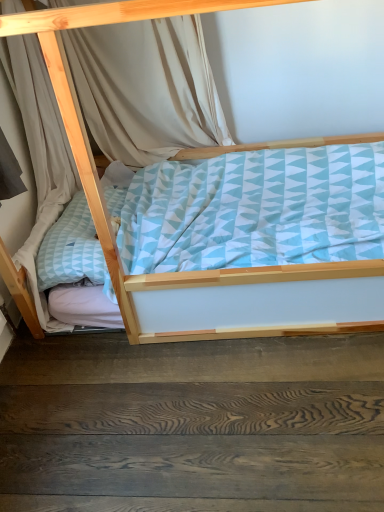
Question: Is dark wood floor at lower center smaller than light blue fabric bed at center?

Choices:
 (A) yes
 (B) no

Answer: (A)

Question: Would you consider dark wood floor at lower center to be distant from light blue fabric bed at center?

Choices:
 (A) no
 (B) yes

Answer: (A)

Question: Could you tell me if dark wood floor at lower center is facing light blue fabric bed at center?

Choices:
 (A) no
 (B) yes

Answer: (A)

Question: From the image's perspective, is dark wood floor at lower center beneath light blue fabric bed at center?

Choices:
 (A) yes
 (B) no

Answer: (A)

Question: Does dark wood floor at lower center have a greater width compared to light blue fabric bed at center?

Choices:
 (A) yes
 (B) no

Answer: (B)

Question: Is light blue fabric bed at center bigger or smaller than dark wood floor at lower center?

Choices:
 (A) big
 (B) small

Answer: (A)

Question: Considering the positions of light blue fabric bed at center and dark wood floor at lower center in the image, is light blue fabric bed at center wider or thinner than dark wood floor at lower center?

Choices:
 (A) thin
 (B) wide

Answer: (B)

Question: From the image's perspective, is light blue fabric bed at center above or below dark wood floor at lower center?

Choices:
 (A) above
 (B) below

Answer: (A)

Question: Is light blue fabric bed at center inside the boundaries of dark wood floor at lower center, or outside?

Choices:
 (A) inside
 (B) outside

Answer: (B)

Question: From their relative heights in the image, would you say beige fabric curtain at upper left is taller or shorter than light blue fabric bed at center?

Choices:
 (A) tall
 (B) short

Answer: (B)

Question: From the image's perspective, is beige fabric curtain at upper left positioned above or below light blue fabric bed at center?

Choices:
 (A) below
 (B) above

Answer: (B)

Question: In terms of width, does beige fabric curtain at upper left look wider or thinner when compared to light blue fabric bed at center?

Choices:
 (A) thin
 (B) wide

Answer: (A)

Question: Which is correct: beige fabric curtain at upper left is inside light blue fabric bed at center, or outside of it?

Choices:
 (A) inside
 (B) outside

Answer: (A)

Question: From the image's perspective, is dark wood floor at lower center above or below beige fabric curtain at upper left?

Choices:
 (A) below
 (B) above

Answer: (A)

Question: In the image, is dark wood floor at lower center positioned in front of or behind beige fabric curtain at upper left?

Choices:
 (A) front
 (B) behind

Answer: (A)